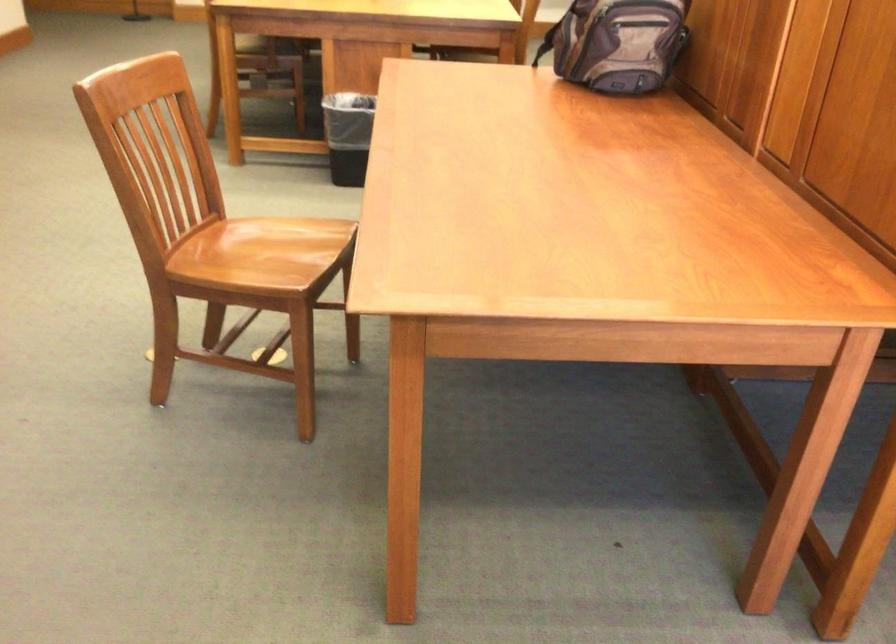
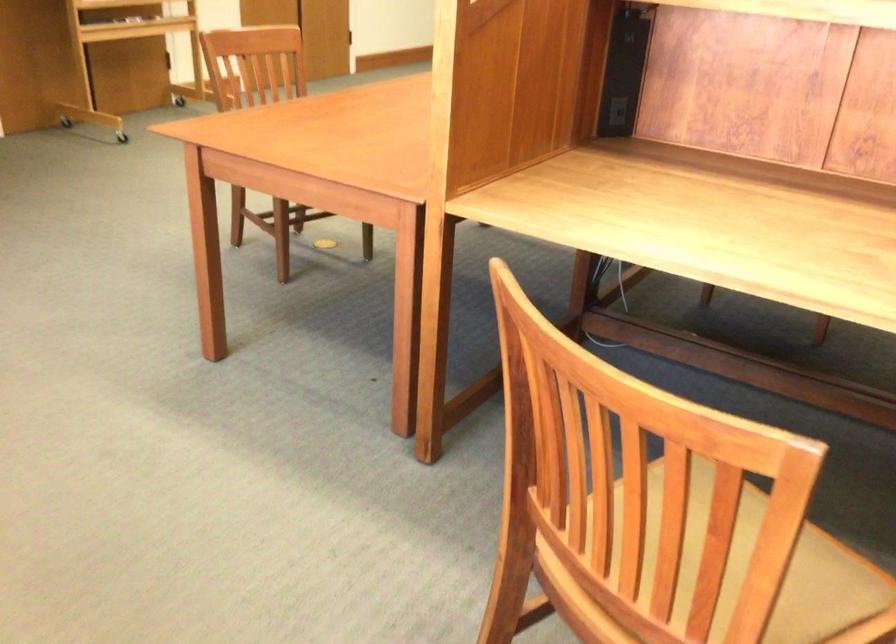
Question: I am providing you with two images of the same scene from different viewpoints. Which of the following objects are not visible in image2?

Choices:
 (A) green backpack
 (B) chair sitting surface
 (C) black trash can
 (D) black power outlet

Answer: (C)